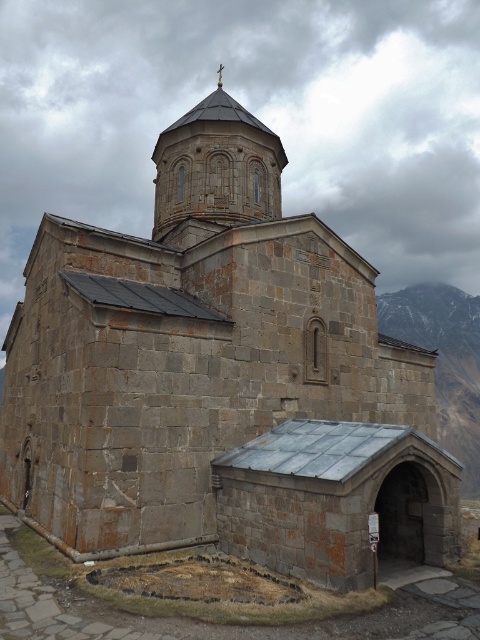
From the picture: Is stone spire at upper center closer to the viewer compared to snowy granite mountain at right?

Yes.

Locate an element on the screen. The height and width of the screenshot is (640, 480). stone spire at upper center is located at coordinates 215,170.

Between point (253, 125) and point (478, 321), which one is positioned behind?

Positioned behind is point (478, 321).

Where is `stone spire at upper center`? The width and height of the screenshot is (480, 640). stone spire at upper center is located at coordinates (215, 170).